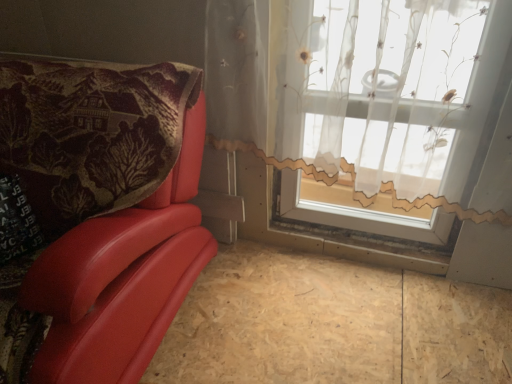
Question: In the image, is matte red leather chair at left positioned in front of or behind plywood at lower left?

Choices:
 (A) behind
 (B) front

Answer: (B)

Question: From a real-world perspective, is matte red leather chair at left positioned above or below plywood at lower left?

Choices:
 (A) below
 (B) above

Answer: (B)

Question: Considering the real-world distances, which object is closest to the translucent floral-patterned curtain at upper right?

Choices:
 (A) matte red leather chair at left
 (B) plywood at lower left

Answer: (A)

Question: Which is farther from the translucent floral-patterned curtain at upper right?

Choices:
 (A) plywood at lower left
 (B) matte red leather chair at left

Answer: (A)